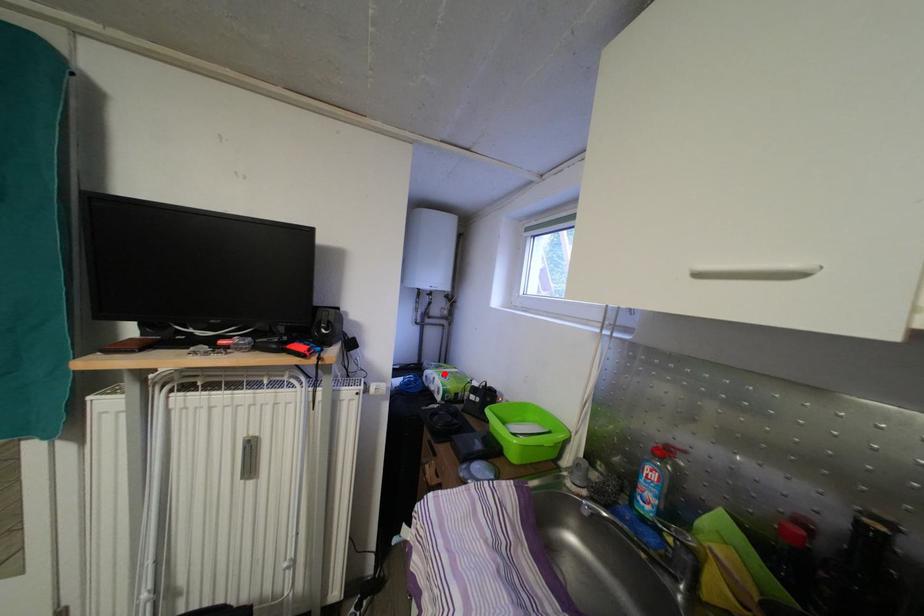
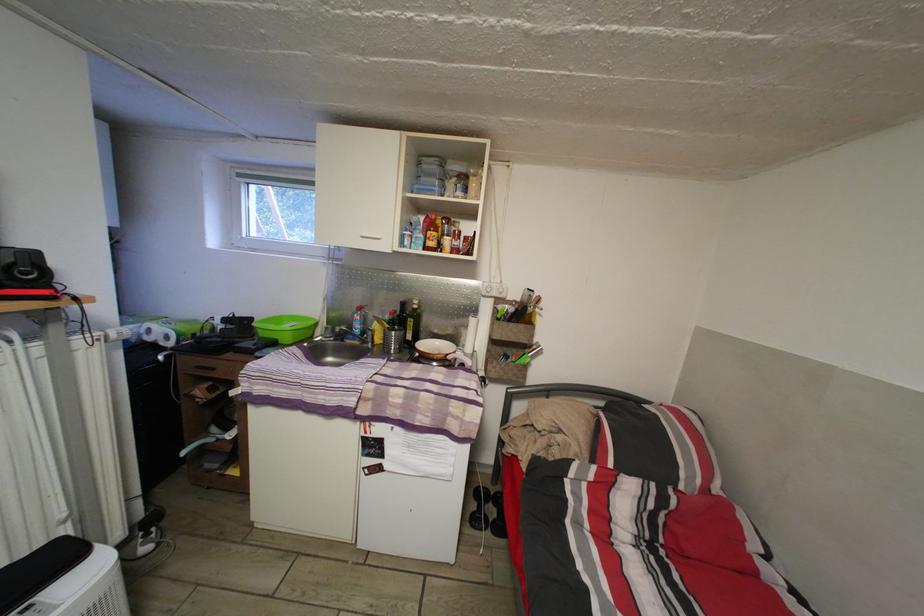
The point at the highlighted location is marked in the first image. Where is the corresponding point in the second image?

(144, 328)